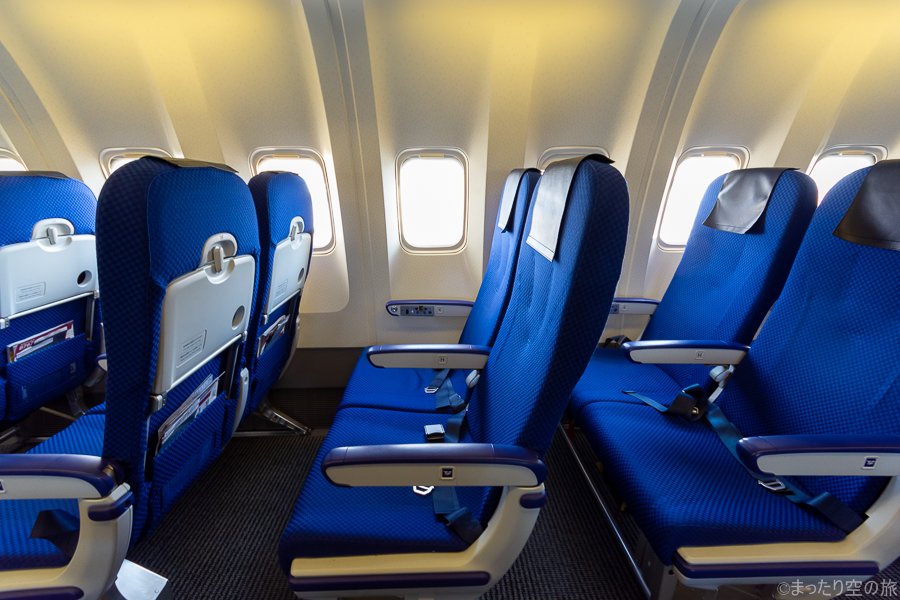
Identify the location of arm rest. This screenshot has width=900, height=600. (102, 359), (22, 481), (394, 358), (384, 472), (634, 304), (454, 306), (662, 349), (807, 464).